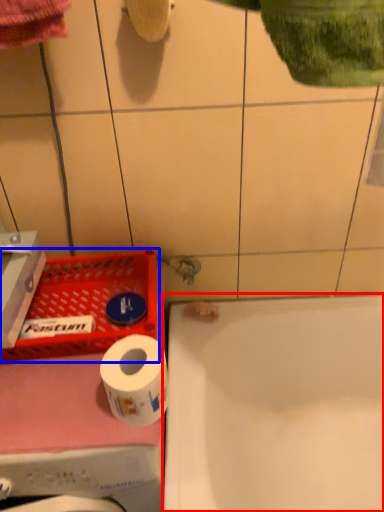
Question: Which of the following is the farthest to the observer, bathtub (highlighted by a red box) or laundry basket (highlighted by a blue box)?

Choices:
 (A) bathtub
 (B) laundry basket

Answer: (B)